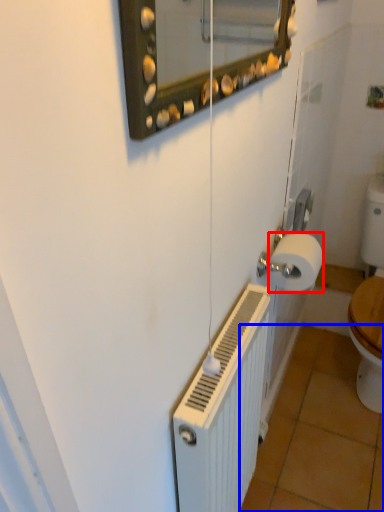
Question: Which of the following is the closest to the observer, toilet paper (highlighted by a red box) or tile (highlighted by a blue box)?

Choices:
 (A) toilet paper
 (B) tile

Answer: (A)